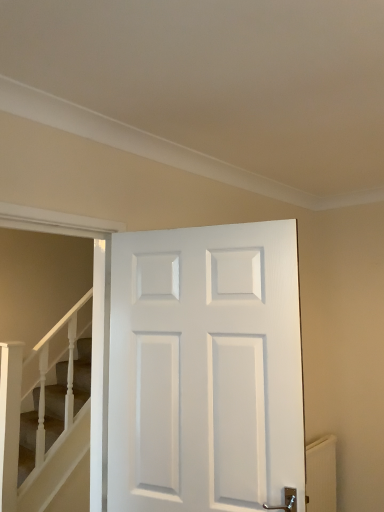
Question: Is white matte door at center located within white textured radiator at lower right?

Choices:
 (A) yes
 (B) no

Answer: (B)

Question: Is white textured radiator at lower right positioned beyond the bounds of white matte door at center?

Choices:
 (A) yes
 (B) no

Answer: (A)

Question: Does white textured radiator at lower right lie in front of white matte door at center?

Choices:
 (A) yes
 (B) no

Answer: (B)

Question: From the image's perspective, is white textured radiator at lower right located above white matte door at center?

Choices:
 (A) no
 (B) yes

Answer: (A)

Question: From a real-world perspective, is white textured radiator at lower right beneath white matte door at center?

Choices:
 (A) yes
 (B) no

Answer: (A)

Question: Considering their positions, is white textured radiator at lower right located in front of or behind white matte door at center?

Choices:
 (A) behind
 (B) front

Answer: (A)

Question: Is white textured radiator at lower right wider or thinner than white matte door at center?

Choices:
 (A) wide
 (B) thin

Answer: (B)

Question: In the image, is white textured radiator at lower right on the left side or the right side of white matte door at center?

Choices:
 (A) right
 (B) left

Answer: (A)

Question: From a real-world perspective, is white textured radiator at lower right positioned above or below white matte door at center?

Choices:
 (A) above
 (B) below

Answer: (B)

Question: Is smooth beige carpet at lower left wider or thinner than white matte door at center?

Choices:
 (A) wide
 (B) thin

Answer: (B)

Question: From the image's perspective, is smooth beige carpet at lower left above or below white matte door at center?

Choices:
 (A) below
 (B) above

Answer: (A)

Question: Relative to white matte door at center, is smooth beige carpet at lower left in front or behind?

Choices:
 (A) front
 (B) behind

Answer: (B)

Question: Is smooth beige carpet at lower left to the left or to the right of white matte door at center in the image?

Choices:
 (A) left
 (B) right

Answer: (A)

Question: In terms of size, does white matte door at center appear bigger or smaller than smooth beige carpet at lower left?

Choices:
 (A) big
 (B) small

Answer: (A)

Question: In terms of width, does white matte door at center look wider or thinner when compared to smooth beige carpet at lower left?

Choices:
 (A) wide
 (B) thin

Answer: (A)